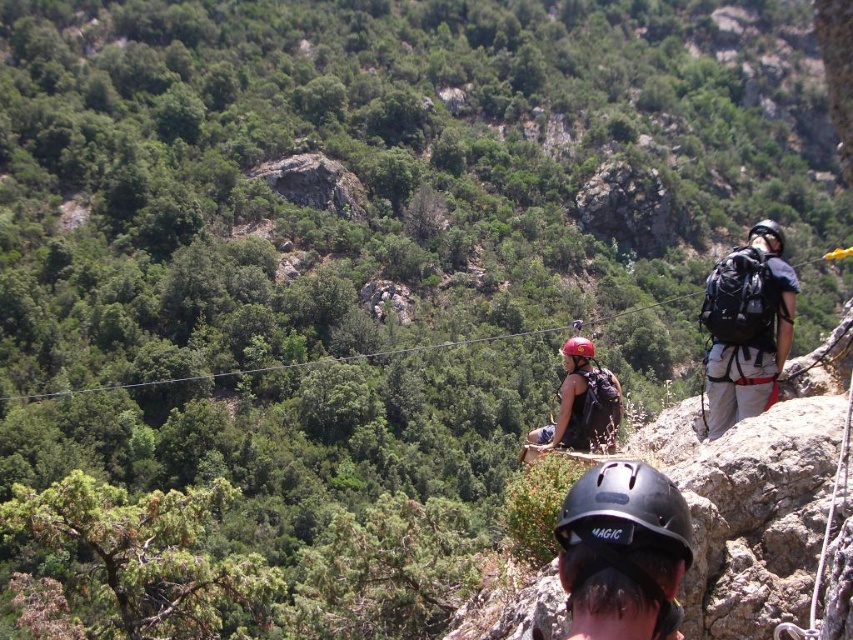
Is point (747, 298) more distant than point (570, 346)?

No, (747, 298) is closer to viewer.

Who is taller, matte black backpack at right or red matte helmet at center?

Standing taller between the two is matte black backpack at right.

In order to click on matte black backpack at right in this screenshot , I will do `click(747, 326)`.

How distant is red matte helmet at center from black matte helmet at upper right?

red matte helmet at center is 188.69 feet away from black matte helmet at upper right.

This screenshot has width=853, height=640. Describe the element at coordinates (577, 353) in the screenshot. I see `red matte helmet at center` at that location.

Who is more distant from viewer, (585,355) or (773,241)?

The point (585,355) is behind.

I want to click on red matte helmet at center, so click(577, 353).

Does matte black backpack at right appear on the left side of black matte helmet at upper right?

Correct, you'll find matte black backpack at right to the left of black matte helmet at upper right.

Which of these two, matte black backpack at right or black matte helmet at upper right, stands shorter?

matte black backpack at right

At what (x,y) coordinates should I click in order to perform the action: click on matte black backpack at right. Please return your answer as a coordinate pair (x, y). The height and width of the screenshot is (640, 853). Looking at the image, I should click on (747, 326).